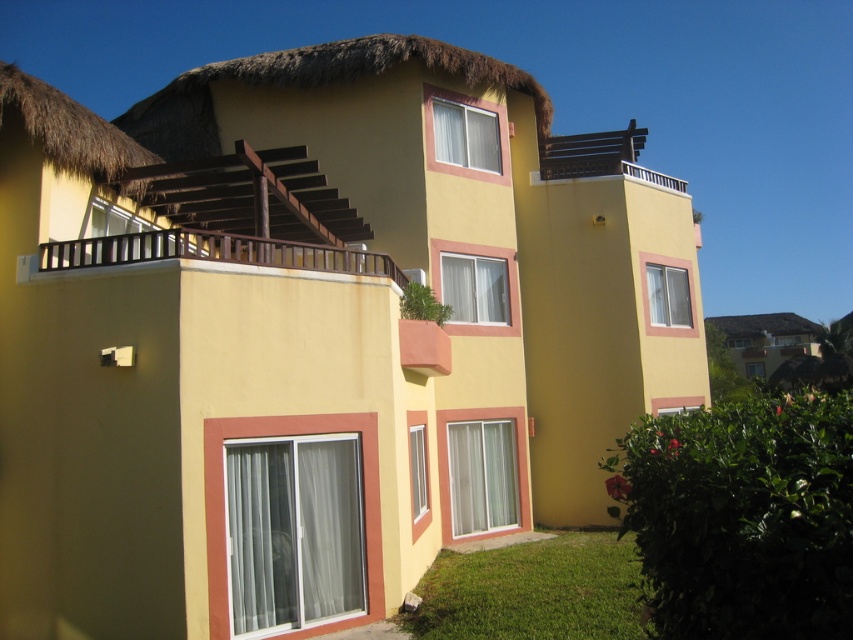
You are standing in a park and see the white wooden balcony at upper center of a building. If you want to reach it, would you need to climb stairs or use an elevator?

The white wooden balcony at upper center is 15.67 meters away from viewer, so you would need to climb stairs to reach it since it is on the upper level of the building.

You are a painter who wants to paint the wooden at upper left and the thatched straw hut at upper right. Which one do you need to use a longer ladder to paint the top?

The thatched straw hut at upper right requires a longer ladder because it is taller than the wooden at upper left.

Based on the photo, you are standing in front of the two story building and want to hang a bird feeder. You have two options, either on the wooden at upper left or the thatched straw roof at upper right. Which location is higher up?

The wooden at upper left is above the thatched straw roof at upper right, so the wooden at upper left is higher up.